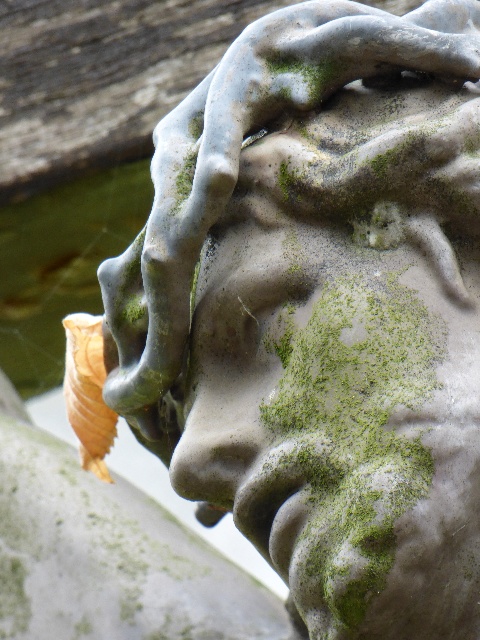
You are a photographer adjusting your camera settings to capture the stone sculpture. You notice two points on the sculpture marked as point 1 at coordinates point (325, 470) and point 2 at coordinates point (100, 365). Which point should you focus on first to ensure both points are in sharp focus?

You should focus on point (100, 365) first because it is farther from the camera than point (325, 470). By focusing on the farther point, the depth of field will naturally include the closer point in sharp focus.

You are a tour guide standing in front of the green mossy stone face at center. You want to ensure visitors can view the sculpture without getting too close. What is the minimum safe distance visitors should maintain to view the sculpture properly?

The minimum safe distance visitors should maintain to view the green mossy stone face at center properly is 1.21 meters, as that is the distance between the sculpture and the viewer.

In the scene shown: You are an archaeologist examining the stone sculpture. You need to document the exact location of the green mossy stone face at center. What are its coordinates?

The green mossy stone face at center is located at coordinates point [338,426].